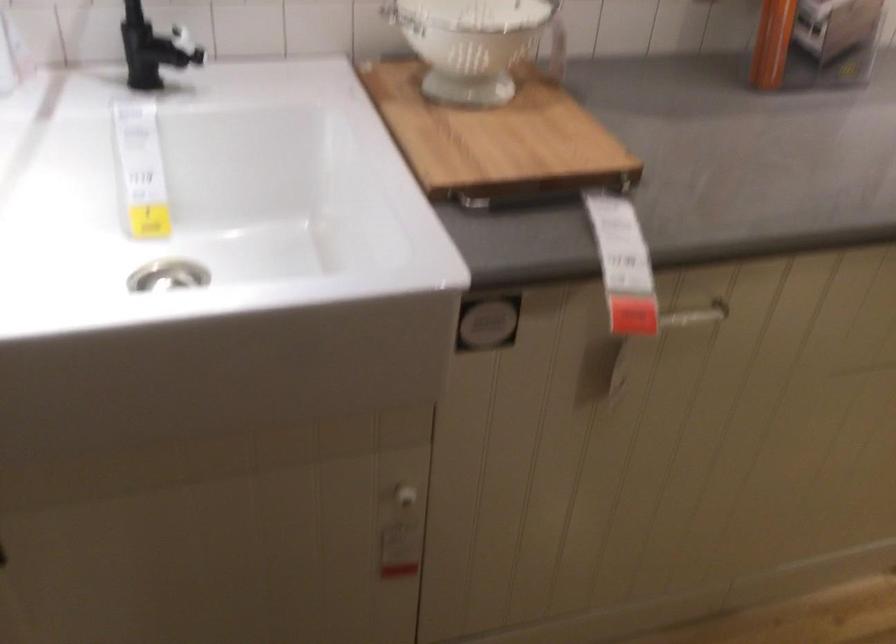
Find where to turn the black faucet handle. Please return your answer as a coordinate pair (x, y).

(152, 49)